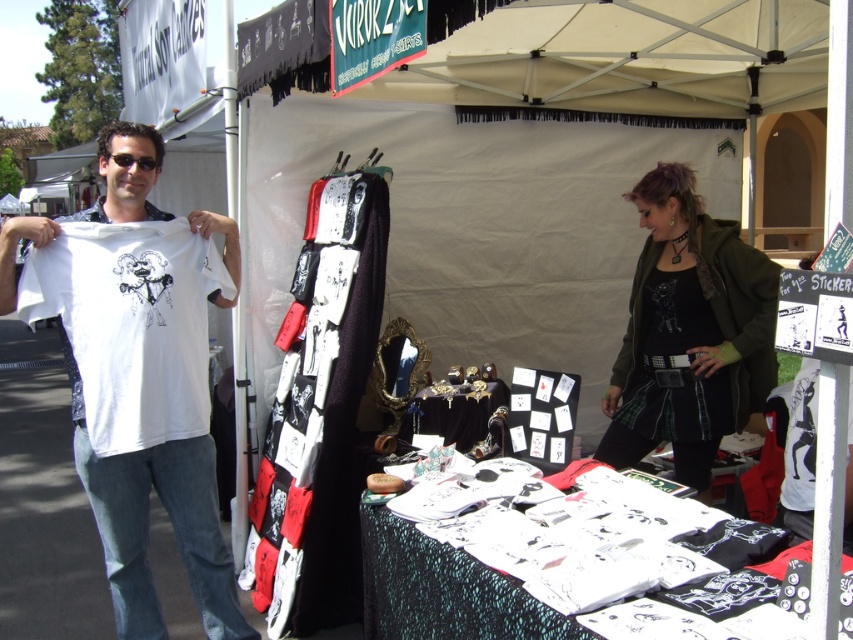
You are standing in front of the market stall and want to reach the point at coordinates (x=178, y=369). The stall owner says you can only move forward or backward. Can you estimate how far you need to move to reach that point?

The point at coordinates (x=178, y=369) is 2.59 meters from the viewer, so you need to move approximately 2.59 meters forward or backward to reach it.